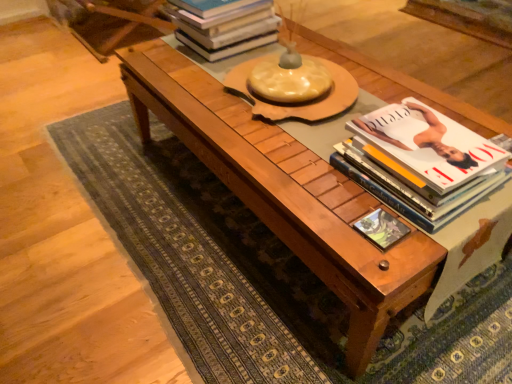
Question: From the image's perspective, is hardcover books at upper center, acting as the second book starting from the front, below matte green book at center?

Choices:
 (A) yes
 (B) no

Answer: (B)

Question: Could matte green book at center be considered to be inside hardcover books at upper center, which ranks as the first book in back-to-front order?

Choices:
 (A) yes
 (B) no

Answer: (B)

Question: Could you tell me if hardcover books at upper center, which is the 1th book in top-to-bottom order, is turned towards matte green book at center?

Choices:
 (A) no
 (B) yes

Answer: (A)

Question: Can you confirm if hardcover books at upper center, acting as the second book starting from the front, is smaller than matte green book at center?

Choices:
 (A) yes
 (B) no

Answer: (B)

Question: From the image's perspective, is hardcover books at upper center, which is the 1th book in top-to-bottom order, located above matte green book at center?

Choices:
 (A) no
 (B) yes

Answer: (B)

Question: Is hardcover books at upper center, which ranks as the first book in back-to-front order, positioned with its back to matte green book at center?

Choices:
 (A) yes
 (B) no

Answer: (B)

Question: Is hardcover books at upper center, which ranks as the first book in back-to-front order, in front of wooden coffee table at center?

Choices:
 (A) yes
 (B) no

Answer: (B)

Question: Considering the relative sizes of hardcover books at upper center, acting as the second book starting from the front, and wooden coffee table at center in the image provided, is hardcover books at upper center, acting as the second book starting from the front, bigger than wooden coffee table at center?

Choices:
 (A) yes
 (B) no

Answer: (B)

Question: Considering the relative positions of hardcover books at upper center, which is the 1th book in top-to-bottom order, and wooden coffee table at center in the image provided, is hardcover books at upper center, which is the 1th book in top-to-bottom order, behind wooden coffee table at center?

Choices:
 (A) no
 (B) yes

Answer: (B)

Question: Can you confirm if hardcover books at upper center, which is counted as the 1th book, starting from the left, is shorter than wooden coffee table at center?

Choices:
 (A) no
 (B) yes

Answer: (B)

Question: From the image's perspective, would you say hardcover books at upper center, positioned as the 2th book in right-to-left order, is shown under wooden coffee table at center?

Choices:
 (A) no
 (B) yes

Answer: (A)

Question: From a real-world perspective, is hardcover books at upper center, which ranks as the first book in back-to-front order, positioned over wooden coffee table at center based on gravity?

Choices:
 (A) no
 (B) yes

Answer: (B)

Question: Considering the relative positions of hardcover books at upper center, positioned as the 2th book in right-to-left order, and white glossy book at right, positioned as the second book in left-to-right order, in the image provided, is hardcover books at upper center, positioned as the 2th book in right-to-left order, behind white glossy book at right, positioned as the second book in left-to-right order,?

Choices:
 (A) no
 (B) yes

Answer: (B)